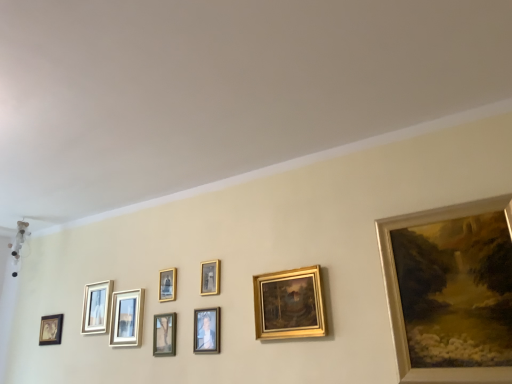
Question: Is matte black picture frame at lower left, which appears as the first picture frame when viewed from the left, to the left or to the right of matte white picture frame at center, which is the seventh picture frame from right to left, in the image?

Choices:
 (A) left
 (B) right

Answer: (A)

Question: In terms of size, does matte black picture frame at lower left, which appears as the first picture frame when viewed from the left, appear bigger or smaller than matte white picture frame at center, which appears as the third picture frame when viewed from the left?

Choices:
 (A) small
 (B) big

Answer: (A)

Question: Estimate the real-world distances between objects in this image. Which object is closer to the matte gold picture frame at upper left, acting as the second picture frame starting from the left?

Choices:
 (A) gold metallic painting at upper right, positioned as the 1th picture frame in right-to-left order
 (B) matte gold picture frame at center, the 6th picture frame viewed from the left
 (C) matte white picture frame at center, which appears as the third picture frame when viewed from the left
 (D) green matte picture frame at center, marked as the 5th picture frame in a right-to-left arrangement
 (E) gold metallic picture frame at center, which appears as the fourth picture frame when viewed from the left

Answer: (C)

Question: Which object is positioned closest to the matte gold picture frame at center, which is the 4th picture frame from right to left?

Choices:
 (A) matte white picture frame at center, which appears as the third picture frame when viewed from the left
 (B) green matte picture frame at center, marked as the 5th picture frame in a right-to-left arrangement
 (C) matte black picture frame at lower left, marked as the 9th picture frame in a right-to-left arrangement
 (D) matte gold picture frame at upper left, which appears as the eighth picture frame when viewed from the right
 (E) gold metallic painting at upper right, which is the 9th picture frame from left to right

Answer: (B)